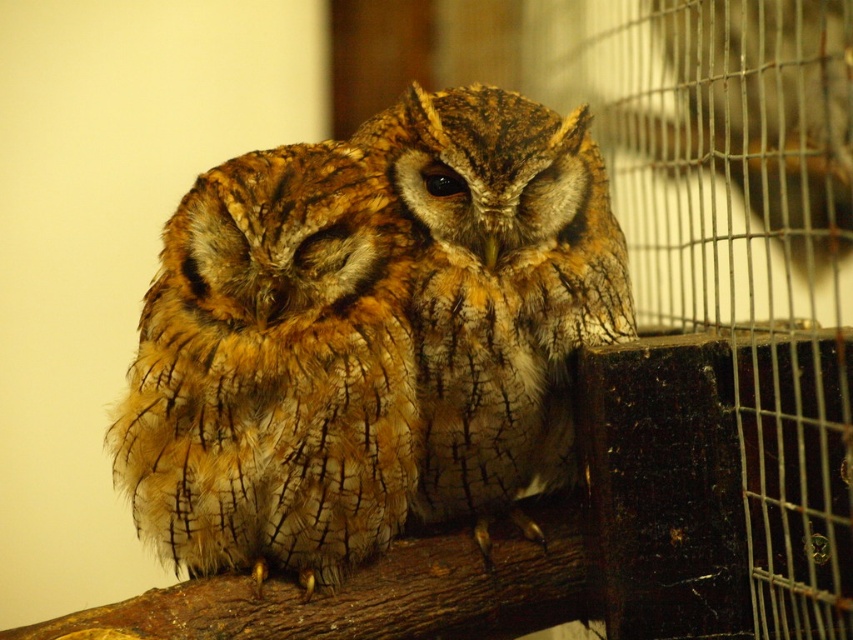
Is brown textured owl at center taller than brown speckled owl at center?

In fact, brown textured owl at center may be shorter than brown speckled owl at center.

Between brown textured owl at center and brown speckled owl at center, which one appears on the right side from the viewer's perspective?

Positioned to the right is brown speckled owl at center.

At what (x,y) coordinates should I click in order to perform the action: click on brown textured owl at center. Please return your answer as a coordinate pair (x, y). Image resolution: width=853 pixels, height=640 pixels. Looking at the image, I should click on (276, 369).